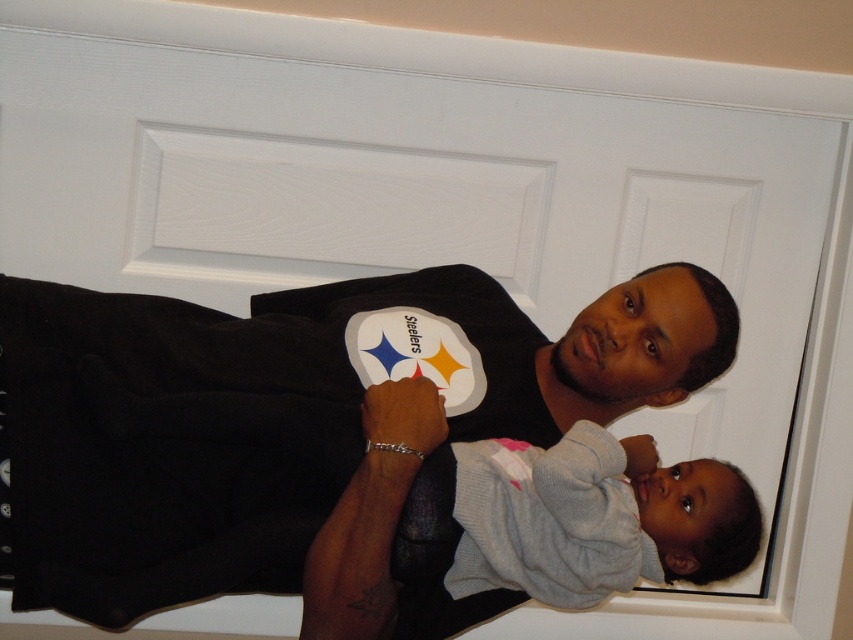
What do you see at coordinates (277, 417) in the screenshot? This screenshot has height=640, width=853. I see `black cotton shirt at center` at bounding box center [277, 417].

Is point (469, 412) positioned after point (592, 560)?

Yes, it is.

Image resolution: width=853 pixels, height=640 pixels. Find the location of `black cotton shirt at center`. black cotton shirt at center is located at coordinates (277, 417).